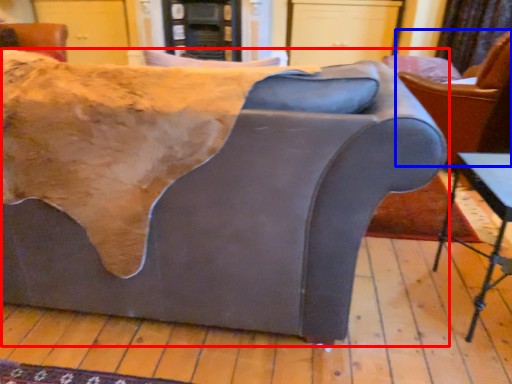
Question: Which point is further to the camera, studio couch (highlighted by a red box) or chair (highlighted by a blue box)?

Choices:
 (A) studio couch
 (B) chair

Answer: (B)